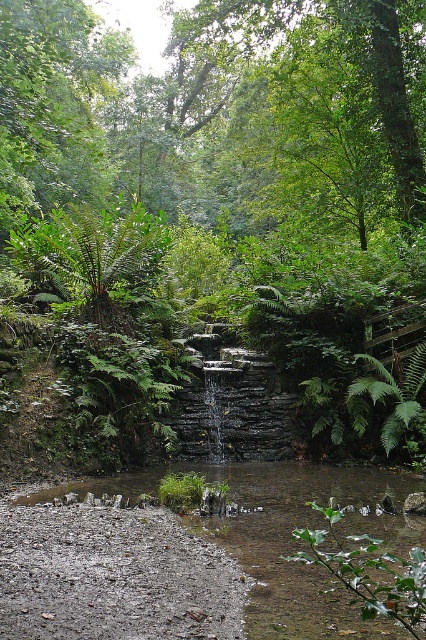
Is point (62, 260) farther from viewer compared to point (368, 612)?

Yes, point (62, 260) is behind point (368, 612).

Who is taller, green leafy fern at upper left or green leafy fern at lower center?

Standing taller between the two is green leafy fern at upper left.

Identify the location of green leafy fern at upper left. Image resolution: width=426 pixels, height=640 pixels. (92, 257).

Is green leafy tree at upper center smaller than clear water at center?

Actually, green leafy tree at upper center might be larger than clear water at center.

Is point (270, 36) in front of point (307, 602)?

No.

This screenshot has height=640, width=426. What are the coordinates of `green leafy tree at upper center` in the screenshot? It's located at (319, 99).

Does green leafy tree at upper center have a greater width compared to green leafy fern at center?

Yes.

Does green leafy tree at upper center have a lesser width compared to green leafy fern at center?

Incorrect, green leafy tree at upper center's width is not less than green leafy fern at center's.

Image resolution: width=426 pixels, height=640 pixels. Identify the location of green leafy tree at upper center. (319, 99).